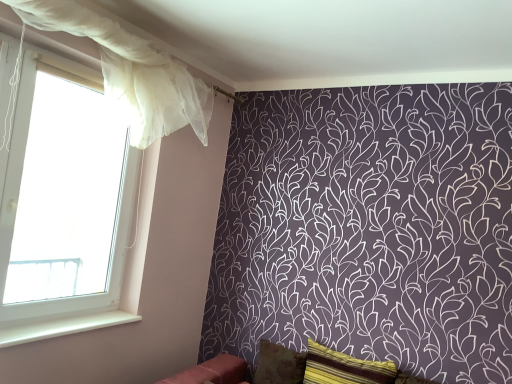
Question: Does translucent white curtain at left appear on the right side of striped fabric pillow at lower right, placed as the second pillow when sorted from back to front?

Choices:
 (A) yes
 (B) no

Answer: (B)

Question: From a real-world perspective, does translucent white curtain at left stand above striped fabric pillow at lower right, placed as the second pillow when sorted from back to front?

Choices:
 (A) yes
 (B) no

Answer: (A)

Question: Considering the relative positions of translucent white curtain at left and striped fabric pillow at lower right, placed as the second pillow when sorted from back to front, in the image provided, is translucent white curtain at left to the left of striped fabric pillow at lower right, placed as the second pillow when sorted from back to front, from the viewer's perspective?

Choices:
 (A) no
 (B) yes

Answer: (B)

Question: Is translucent white curtain at left not within striped fabric pillow at lower right, placed as the second pillow when sorted from back to front?

Choices:
 (A) yes
 (B) no

Answer: (A)

Question: Is translucent white curtain at left wider than striped fabric pillow at lower right, marked as the first pillow in a front-to-back arrangement?

Choices:
 (A) yes
 (B) no

Answer: (A)

Question: Is translucent white curtain at left positioned with its back to striped fabric pillow at lower right, marked as the first pillow in a front-to-back arrangement?

Choices:
 (A) no
 (B) yes

Answer: (A)

Question: Is brown textured pillow at lower center, which is the 2th pillow from front to back, closer to camera compared to white smooth window sill at lower left?

Choices:
 (A) no
 (B) yes

Answer: (A)

Question: From the image's perspective, would you say brown textured pillow at lower center, which is the 2th pillow from front to back, is shown under white smooth window sill at lower left?

Choices:
 (A) yes
 (B) no

Answer: (A)

Question: Can you confirm if brown textured pillow at lower center, which is the 2th pillow from front to back, is bigger than white smooth window sill at lower left?

Choices:
 (A) no
 (B) yes

Answer: (B)

Question: From a real-world perspective, is brown textured pillow at lower center, the first pillow viewed from the back, located beneath white smooth window sill at lower left?

Choices:
 (A) no
 (B) yes

Answer: (B)

Question: Are brown textured pillow at lower center, which is the 2th pillow from front to back, and white smooth window sill at lower left making contact?

Choices:
 (A) no
 (B) yes

Answer: (A)

Question: Does brown textured pillow at lower center, the first pillow viewed from the back, have a greater width compared to white smooth window sill at lower left?

Choices:
 (A) yes
 (B) no

Answer: (B)

Question: From the image's perspective, would you say velvet red sofa at lower center is positioned over white smooth window sill at lower left?

Choices:
 (A) yes
 (B) no

Answer: (B)